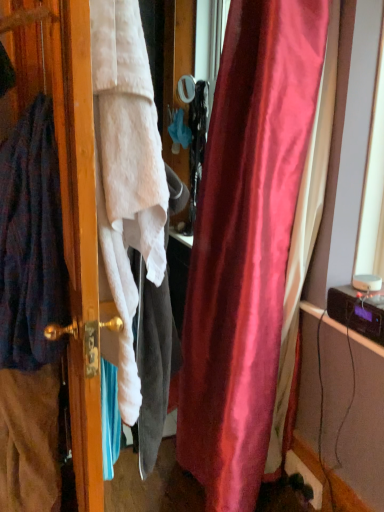
Question: Considering the positions of white fabric screen door at left and dark blue woolen cardigan at left in the image, is white fabric screen door at left bigger or smaller than dark blue woolen cardigan at left?

Choices:
 (A) big
 (B) small

Answer: (A)

Question: Is white fabric screen door at left in front of or behind dark blue woolen cardigan at left in the image?

Choices:
 (A) front
 (B) behind

Answer: (A)

Question: Do you think white fabric screen door at left is within dark blue woolen cardigan at left, or outside of it?

Choices:
 (A) inside
 (B) outside

Answer: (B)

Question: Would you say dark blue woolen cardigan at left is inside or outside white fabric screen door at left?

Choices:
 (A) inside
 (B) outside

Answer: (A)

Question: From the image's perspective, is dark blue woolen cardigan at left above or below white fabric screen door at left?

Choices:
 (A) above
 (B) below

Answer: (A)

Question: In terms of width, does dark blue woolen cardigan at left look wider or thinner when compared to white fabric screen door at left?

Choices:
 (A) thin
 (B) wide

Answer: (A)

Question: From a real-world perspective, is dark blue woolen cardigan at left above or below white fabric screen door at left?

Choices:
 (A) above
 (B) below

Answer: (A)